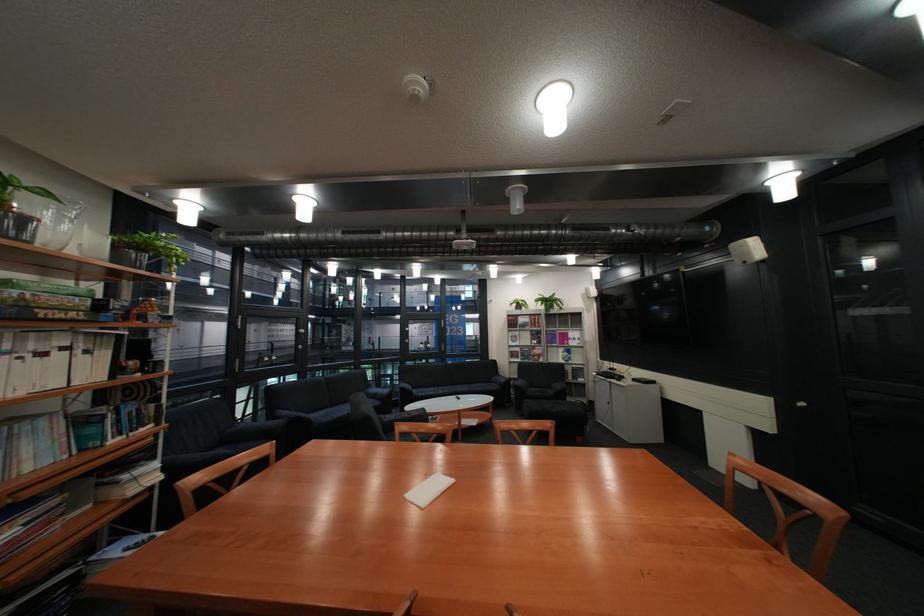
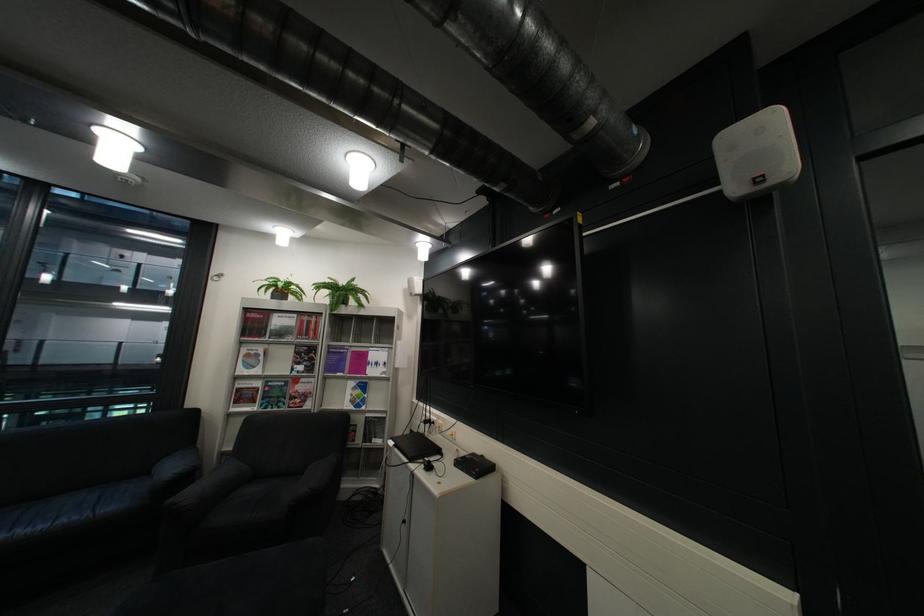
The point at (546, 334) is marked in the first image. Where is the corresponding point in the second image?

(311, 353)